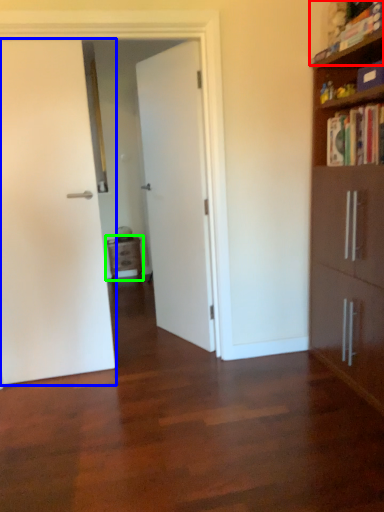
Question: Which is nearer to the book (highlighted by a red box)? door (highlighted by a blue box) or nightstand (highlighted by a green box).

Choices:
 (A) door
 (B) nightstand

Answer: (A)